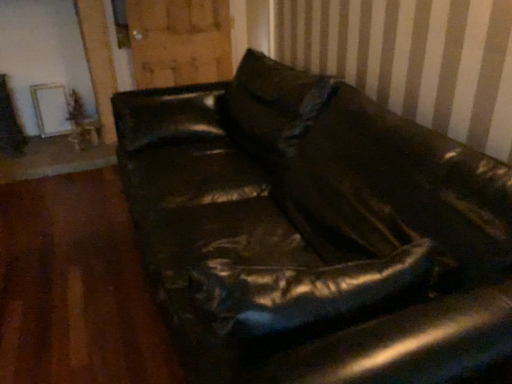
Question: Looking at the image, does wooden at upper center seem bigger or smaller compared to wooden table at lower left?

Choices:
 (A) big
 (B) small

Answer: (A)

Question: Considering the positions of wooden at upper center and wooden table at lower left in the image, is wooden at upper center wider or thinner than wooden table at lower left?

Choices:
 (A) wide
 (B) thin

Answer: (B)

Question: Estimate the real-world distances between objects in this image. Which object is closer to the wooden at upper center?

Choices:
 (A) leather couch at center
 (B) wooden table at lower left

Answer: (B)

Question: Which object is positioned farthest from the wooden table at lower left?

Choices:
 (A) leather couch at center
 (B) wooden at upper center

Answer: (A)